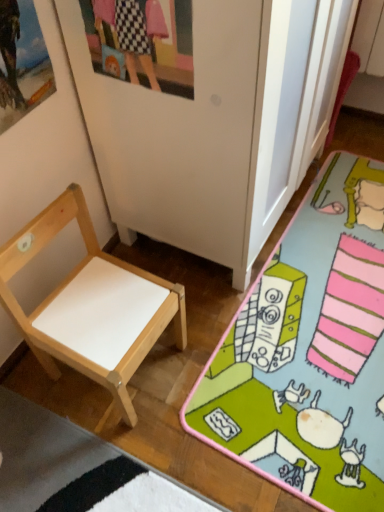
Find the location of a particular element. The image size is (384, 512). vacant area on top of white matte desk at lower left (from a real-world perspective) is located at coordinates (333, 296).